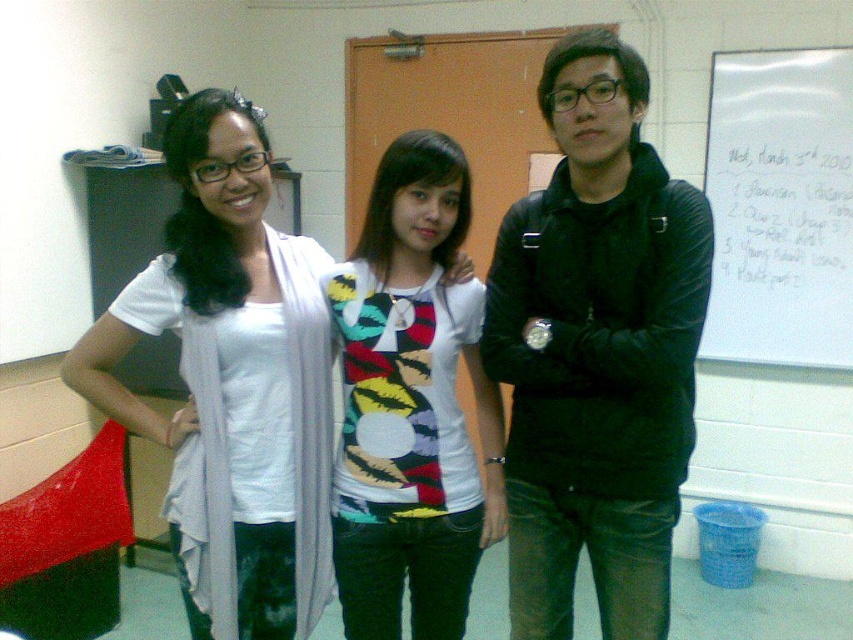
Question: Based on their relative distances, which object is nearer to the multicolored jersey at center?

Choices:
 (A) white matte scarf at left
 (B) white paper at upper right
 (C) black matte jacket at center

Answer: (A)

Question: Is black matte jacket at center closer to the viewer compared to white matte scarf at left?

Choices:
 (A) yes
 (B) no

Answer: (A)

Question: Among these objects, which one is farthest from the camera?

Choices:
 (A) white paper at upper right
 (B) white matte scarf at left
 (C) multicolored jersey at center
 (D) black matte jacket at center

Answer: (A)

Question: Is black matte jacket at center above multicolored jersey at center?

Choices:
 (A) yes
 (B) no

Answer: (A)

Question: Based on their relative distances, which object is nearer to the black matte jacket at center?

Choices:
 (A) white matte scarf at left
 (B) multicolored jersey at center

Answer: (B)

Question: Can you confirm if black matte jacket at center is wider than multicolored jersey at center?

Choices:
 (A) yes
 (B) no

Answer: (A)